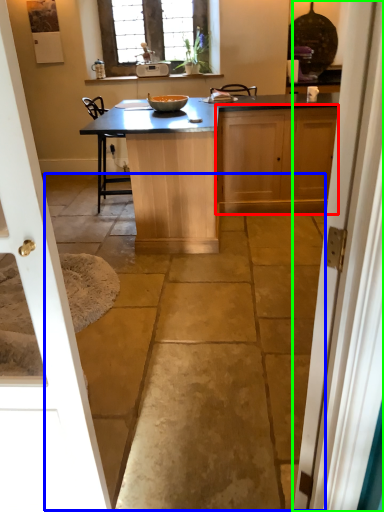
Question: Which is farther away from cabinetry (highlighted by a red box)? concrete (highlighted by a blue box) or door (highlighted by a green box)?

Choices:
 (A) concrete
 (B) door

Answer: (B)